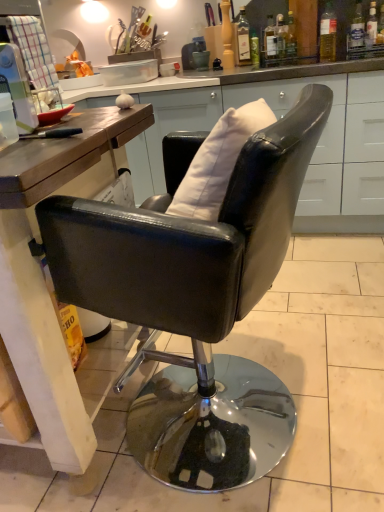
The height and width of the screenshot is (512, 384). What are the coordinates of `black leather chair at center` in the screenshot? It's located at (195, 300).

In order to face black leather chair at center, should I rotate leftwards or rightwards?

You should rotate right by 1.279 degrees.

The image size is (384, 512). What do you see at coordinates (270, 42) in the screenshot? I see `translucent glass bottle at upper right, the 6th bottle in the right-to-left sequence` at bounding box center [270, 42].

In order to face clear glass bottle at upper right, which ranks as the seventh bottle in left-to-right order, should I rotate leftwards or rightwards?

To face it directly, rotate right by 21.541 degrees.

This screenshot has width=384, height=512. What are the coordinates of `translucent glass bottle at upper right, acting as the 3th bottle starting from the right` in the screenshot? It's located at (328, 34).

What is the approximate width of translucent glass bottle at upper right, acting as the 3th bottle starting from the right?

It is 3.46 inches.

At what (x,y) coordinates should I click in order to perform the action: click on black leather chair at center. Please return your answer as a coordinate pair (x, y). Looking at the image, I should click on (195, 300).

Is translucent glass bottle at upper center, acting as the 1th bottle starting from the left, far away from translucent glass bottle at upper right, acting as the 3th bottle starting from the right?

translucent glass bottle at upper center, acting as the 1th bottle starting from the left, is near translucent glass bottle at upper right, acting as the 3th bottle starting from the right, not far away.

Considering the positions of points (238, 24) and (333, 41), is point (238, 24) closer to camera compared to point (333, 41)?

No, (238, 24) is further to viewer.

From the image's perspective, is translucent glass bottle at upper center, which appears as the eighth bottle when viewed from the right, below translucent glass bottle at upper right, acting as the 3th bottle starting from the right?

Yes, from the image's perspective, translucent glass bottle at upper center, which appears as the eighth bottle when viewed from the right, is beneath translucent glass bottle at upper right, acting as the 3th bottle starting from the right.

From the image's perspective, count 8th bottles upward from the plastic container at left and point to it. Please provide its 2D coordinates.

[(357, 33)]

From a real-world perspective, is plastic container at left physically located above or below clear glass bottle at upper right, which is the 2th bottle in right-to-left order?

plastic container at left is below clear glass bottle at upper right, which is the 2th bottle in right-to-left order.

In the scene shown: Which object is positioned more to the right, plastic container at left or clear glass bottle at upper right, which is the 2th bottle in right-to-left order?

Positioned to the right is clear glass bottle at upper right, which is the 2th bottle in right-to-left order.

Does point (31, 131) appear closer or farther from the camera than point (362, 55)?

Point (31, 131) is closer to the camera than point (362, 55).

From the image's perspective, is clear glass bottle at upper right, which is the 2th bottle in right-to-left order, below white matte pillow at center?

No.

Is white matte pillow at center located within clear glass bottle at upper right, which is the 2th bottle in right-to-left order?

No, white matte pillow at center is not a part of clear glass bottle at upper right, which is the 2th bottle in right-to-left order.

Is clear glass bottle at upper right, which ranks as the seventh bottle in left-to-right order, facing away from white matte pillow at center?

That's not correct — clear glass bottle at upper right, which ranks as the seventh bottle in left-to-right order, is not looking away from white matte pillow at center.

In terms of width, does clear glass bottle at upper right, which ranks as the seventh bottle in left-to-right order, look wider or thinner when compared to white matte pillow at center?

Considering their sizes, clear glass bottle at upper right, which ranks as the seventh bottle in left-to-right order, looks slimmer than white matte pillow at center.

Is clear glass bottle at upper right, which ranks as the seventh bottle in left-to-right order, completely or partially inside metallic silver plate at upper center?

No, clear glass bottle at upper right, which ranks as the seventh bottle in left-to-right order, is located outside of metallic silver plate at upper center.

From the image's perspective, is metallic silver plate at upper center above or below clear glass bottle at upper right, which ranks as the seventh bottle in left-to-right order?

From the image's perspective, metallic silver plate at upper center appears below clear glass bottle at upper right, which ranks as the seventh bottle in left-to-right order.

Is metallic silver plate at upper center smaller than clear glass bottle at upper right, which ranks as the seventh bottle in left-to-right order?

No, metallic silver plate at upper center is not smaller than clear glass bottle at upper right, which ranks as the seventh bottle in left-to-right order.

Can you confirm if metallic silver plate at upper center is positioned to the left of clear glass bottle at upper right, which is the 2th bottle in right-to-left order?

Correct, you'll find metallic silver plate at upper center to the left of clear glass bottle at upper right, which is the 2th bottle in right-to-left order.

Between translucent glass bottle at upper center, arranged as the seventh bottle when viewed from the right, and matte wood countertop at center, which one appears on the left side from the viewer's perspective?

From the viewer's perspective, matte wood countertop at center appears more on the left side.

Is translucent glass bottle at upper center, arranged as the seventh bottle when viewed from the right, bigger or smaller than matte wood countertop at center?

Clearly, translucent glass bottle at upper center, arranged as the seventh bottle when viewed from the right, is smaller in size than matte wood countertop at center.

The height and width of the screenshot is (512, 384). I want to click on counter top in front of the translucent glass bottle at upper center, arranged as the 2th bottle when viewed from the left, so click(x=279, y=118).

Is translucent glass bottle at upper center, arranged as the seventh bottle when viewed from the right, positioned before matte wood countertop at center?

No, it is not.

Between black leather chair at center and translucent glass bottle at upper right, the 6th bottle in the right-to-left sequence, which one is positioned behind?

Positioned behind is translucent glass bottle at upper right, the 6th bottle in the right-to-left sequence.

Is black leather chair at center beside translucent glass bottle at upper right, which is counted as the 3th bottle, starting from the left?

No.

Which is in front, point (152, 238) or point (269, 61)?

The point (152, 238) is closer to the camera.

Would you say translucent glass bottle at upper right, which is counted as the 3th bottle, starting from the left, is part of black leather chair at center's contents?

No, translucent glass bottle at upper right, which is counted as the 3th bottle, starting from the left, is located outside of black leather chair at center.

Which object is more forward, plastic container at left or translucent glass bottle at upper right, the 4th bottle positioned from the left?

plastic container at left is in front.

Would you say plastic container at left is inside or outside translucent glass bottle at upper right, the 5th bottle from the right?

plastic container at left is outside translucent glass bottle at upper right, the 5th bottle from the right.

Considering the points (21, 87) and (281, 24), which point is behind, point (21, 87) or point (281, 24)?

Point (281, 24)

This screenshot has height=512, width=384. I want to click on the 1st bottle behind the translucent glass bottle at upper right, acting as the 3th bottle starting from the right, starting your count from the anchor, so click(x=243, y=38).

Image resolution: width=384 pixels, height=512 pixels. Identify the location of appliance located underneath the clear glass bottle at upper right, which ranks as the seventh bottle in left-to-right order (from a real-world perspective). (17, 87).

Looking at the image, which one is located further to translucent glass bottle at upper right, the 6th bottle in the right-to-left sequence, white matte pillow at center or metallic silver plate at upper center?

white matte pillow at center is positioned further to the anchor translucent glass bottle at upper right, the 6th bottle in the right-to-left sequence.

Based on their spatial positions, is clear glass bottle at upper right, which is the 2th bottle in right-to-left order, or clear glass bottle at upper right, which is the 1th bottle in right-to-left order, further from matte wood countertop at center?

clear glass bottle at upper right, which is the 1th bottle in right-to-left order, is further to matte wood countertop at center.

Based on their spatial positions, is matte wood countertop at center or translucent glass bottle at upper center, arranged as the 2th bottle when viewed from the left, closer to clear glass bottle at upper right, which ranks as the seventh bottle in left-to-right order?

translucent glass bottle at upper center, arranged as the 2th bottle when viewed from the left, is positioned closer to the anchor clear glass bottle at upper right, which ranks as the seventh bottle in left-to-right order.

In the scene shown: Estimate the real-world distances between objects in this image. Which object is closer to translucent glass bottle at upper center, which appears as the eighth bottle when viewed from the right, translucent glass bottle at upper right, the 4th bottle positioned from the left, or white matte pillow at center?

translucent glass bottle at upper right, the 4th bottle positioned from the left, is positioned closer to the anchor translucent glass bottle at upper center, which appears as the eighth bottle when viewed from the right.

From the image, which object appears to be farther from translucent glass bottle at upper right, acting as the 3th bottle starting from the right, clear glass bottle at upper right, the eighth bottle viewed from the left, or metallic silver plate at upper center?

Based on the image, metallic silver plate at upper center appears to be further to translucent glass bottle at upper right, acting as the 3th bottle starting from the right.

From the image, which object appears to be nearer to translucent glass bottle at upper right, which is counted as the 3th bottle, starting from the left, translucent glass bottle at upper center, arranged as the seventh bottle when viewed from the right, or translucent glass bottle at upper right, the fourth bottle in the right-to-left sequence?

The object closer to translucent glass bottle at upper right, which is counted as the 3th bottle, starting from the left, is translucent glass bottle at upper center, arranged as the seventh bottle when viewed from the right.

Looking at the image, which one is located further to white matte pillow at center, clear glass bottle at upper right, which ranks as the seventh bottle in left-to-right order, or clear glass bottle at upper right, the eighth bottle viewed from the left?

clear glass bottle at upper right, the eighth bottle viewed from the left, lies further to white matte pillow at center than the other object.

From the image, which object appears to be nearer to translucent glass bottle at upper center, acting as the 1th bottle starting from the left, clear glass bottle at upper right, which is the 1th bottle in right-to-left order, or plastic container at left?

Among the two, clear glass bottle at upper right, which is the 1th bottle in right-to-left order, is located nearer to translucent glass bottle at upper center, acting as the 1th bottle starting from the left.

You are a GUI agent. You are given a task and a screenshot of the screen. Output one action in this format:
    pyautogui.click(x=<x>, y=<y>)
    Task: Click on the plate between plastic container at left and translucent glass bottle at upper center, arranged as the 2th bottle when viewed from the left, from front to back
    This screenshot has width=384, height=512.
    Given the screenshot: What is the action you would take?
    click(129, 72)

Where is `pillow between black leather chair at center and translucent glass bottle at upper right, the fifth bottle when ordered from left to right, from front to back`? pillow between black leather chair at center and translucent glass bottle at upper right, the fifth bottle when ordered from left to right, from front to back is located at coordinates 218,161.

Find the location of `counter top between white matte pillow at center and translucent glass bottle at upper right, which is counted as the 3th bottle, starting from the left, along the z-axis`. counter top between white matte pillow at center and translucent glass bottle at upper right, which is counted as the 3th bottle, starting from the left, along the z-axis is located at coordinates (279, 118).

The width and height of the screenshot is (384, 512). I want to click on appliance positioned between white matte pillow at center and clear glass bottle at upper right, which ranks as the seventh bottle in left-to-right order, from near to far, so click(x=17, y=87).